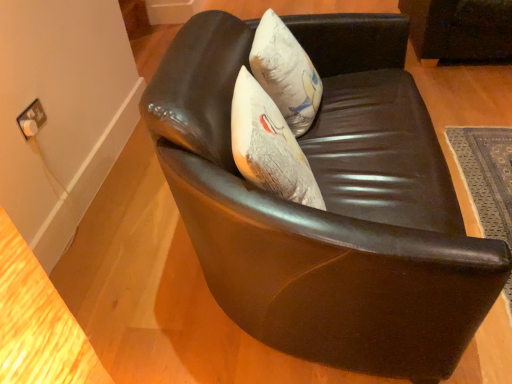
I want to click on dark gray woven mat at lower right, so click(486, 175).

Describe the element at coordinates (486, 175) in the screenshot. The image size is (512, 384). I see `dark gray woven mat at lower right` at that location.

The width and height of the screenshot is (512, 384). I want to click on dark gray woven mat at lower right, so (486, 175).

Is shiny black leather chair at center smaller than dark gray woven mat at lower right?

No, shiny black leather chair at center is not smaller than dark gray woven mat at lower right.

Considering the relative sizes of shiny black leather chair at center and dark gray woven mat at lower right in the image provided, is shiny black leather chair at center wider than dark gray woven mat at lower right?

No.

Is shiny black leather chair at center next to dark gray woven mat at lower right and touching it?

No, shiny black leather chair at center is not beside dark gray woven mat at lower right.

Considering the positions of objects shiny black leather chair at center and dark gray woven mat at lower right in the image provided, who is more to the left, shiny black leather chair at center or dark gray woven mat at lower right?

Positioned to the left is shiny black leather chair at center.

Between white fabric pillow at center and dark gray woven mat at lower right, which one has smaller width?

white fabric pillow at center.

Does white fabric pillow at center turn towards dark gray woven mat at lower right?

Yes.

Is point (253, 62) closer to viewer compared to point (476, 141)?

Yes, point (253, 62) is closer to viewer.

Which of these two, white fabric pillow at center or dark gray woven mat at lower right, is smaller?

dark gray woven mat at lower right.

From a real-world perspective, is dark gray woven mat at lower right physically below white fabric pillow at center?

Yes, from a real-world perspective, dark gray woven mat at lower right is below white fabric pillow at center.

The image size is (512, 384). In the image, there is a dark gray woven mat at lower right. Find the location of `throw pillow above it (from the image's perspective)`. throw pillow above it (from the image's perspective) is located at coordinates (286, 73).

Between dark gray woven mat at lower right and white fabric pillow at center, which one has more height?

Standing taller between the two is white fabric pillow at center.

Relative to white fabric pillow at center, is shiny black leather chair at center in front or behind?

shiny black leather chair at center is positioned closer to the viewer than white fabric pillow at center.

Is shiny black leather chair at center wider than white fabric pillow at center?

Yes.

From a real-world perspective, who is located higher, shiny black leather chair at center or white fabric pillow at center?

white fabric pillow at center.

Is white fabric pillow at center inside shiny black leather chair at center?

Yes.

From a real-world perspective, is dark gray woven mat at lower right beneath shiny black leather chair at center?

Yes, from a real-world perspective, dark gray woven mat at lower right is under shiny black leather chair at center.

Does dark gray woven mat at lower right have a lesser height compared to shiny black leather chair at center?

Indeed, dark gray woven mat at lower right has a lesser height compared to shiny black leather chair at center.

Does dark gray woven mat at lower right appear on the right side of shiny black leather chair at center?

Correct, you'll find dark gray woven mat at lower right to the right of shiny black leather chair at center.

Considering the relative sizes of white fabric pillow at center and shiny black leather chair at center in the image provided, is white fabric pillow at center shorter than shiny black leather chair at center?

Yes.

How different are the orientations of white fabric pillow at center and shiny black leather chair at center in degrees?

The facing directions of white fabric pillow at center and shiny black leather chair at center are 2.83 degrees apart.

Based on the photo, is the surface of white fabric pillow at center in direct contact with shiny black leather chair at center?

No, white fabric pillow at center is not making contact with shiny black leather chair at center.

Considering the sizes of white fabric pillow at center and shiny black leather chair at center in the image, is white fabric pillow at center bigger or smaller than shiny black leather chair at center?

white fabric pillow at center is smaller than shiny black leather chair at center.

Locate an element on the screen. mat that appears below the shiny black leather chair at center (from a real-world perspective) is located at coordinates (486, 175).

You are a GUI agent. You are given a task and a screenshot of the screen. Output one action in this format:
    pyautogui.click(x=<x>, y=<y>)
    Task: Click on the mat in front of the white fabric pillow at center
    The height and width of the screenshot is (384, 512).
    Given the screenshot: What is the action you would take?
    pyautogui.click(x=486, y=175)

Which object lies nearer to the anchor point shiny black leather chair at center, dark gray woven mat at lower right or white fabric pillow at center?

white fabric pillow at center lies closer to shiny black leather chair at center than the other object.

Estimate the real-world distances between objects in this image. Which object is closer to shiny black leather chair at center, white fabric pillow at center or dark gray woven mat at lower right?

The object closer to shiny black leather chair at center is white fabric pillow at center.

Looking at the image, which one is located further to dark gray woven mat at lower right, shiny black leather chair at center or white fabric pillow at center?

white fabric pillow at center.

Which object lies further to the anchor point white fabric pillow at center, shiny black leather chair at center or dark gray woven mat at lower right?

dark gray woven mat at lower right lies further to white fabric pillow at center than the other object.

From the image, which object appears to be nearer to white fabric pillow at center, dark gray woven mat at lower right or shiny black leather chair at center?

shiny black leather chair at center is positioned closer to the anchor white fabric pillow at center.

When comparing their distances from dark gray woven mat at lower right, does white fabric pillow at center or shiny black leather chair at center seem closer?

shiny black leather chair at center lies closer to dark gray woven mat at lower right than the other object.

Where is `chair between white fabric pillow at center and dark gray woven mat at lower right from left to right`? The height and width of the screenshot is (384, 512). chair between white fabric pillow at center and dark gray woven mat at lower right from left to right is located at coordinates (328, 203).